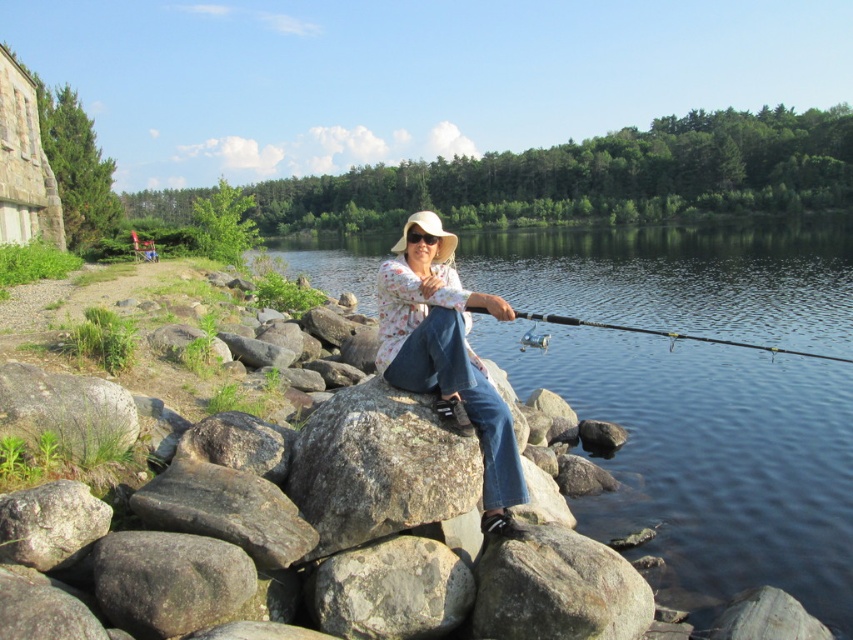
You are a photographer standing at the lakeside and want to take a photo of the gray rough rock at lower center and the shiny metallic fishing pole at center. Which object will appear larger in the photo?

The gray rough rock at lower center will appear larger in the photo because it is closer to the viewer than the shiny metallic fishing pole at center.

You are standing at the point labeled point (503, 589) and want to cast your fishing rod to the center of the lake. Considering the distance between you and the center of the lake is 16.13 feet, will your fishing rod reach the center if it has a maximum casting distance of 15 feet?

The distance between you and the center of the lake is 16.13 feet, which is greater than the fishing rod maximum casting distance of 15 feet. Therefore, the fishing rod cannot reach the center of the lake.

You are a photographer planning to capture the serene lakeside scene. You notice the clear water at center and the shiny metallic fishing pole at center. Which object should you focus on if you want to highlight something larger in the image?

The clear water at center is bigger than the shiny metallic fishing pole at center, so focusing on the clear water at center would highlight the larger object.